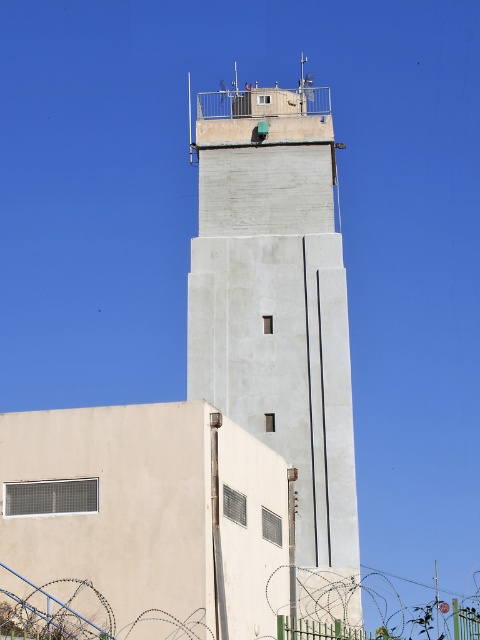
You are an engineer assessing the structural integrity of the scene. Given that the concrete tower at upper center and the green wire mesh fence at center are both subject to wind forces, which structure might experience greater lateral deflection due to its width? Please explain based on their widths.

The concrete tower at upper center has a larger width than the green wire mesh fence at center. Since wider structures generally have greater stiffness and resistance to lateral deflection, the green wire mesh fence at center would likely experience more deflection under wind forces compared to the concrete tower at upper center.

You are standing in a field and see the concrete tower at upper center and the green wire mesh fence at center. Which object is closer to you?

The concrete tower at upper center is closer to you because the green wire mesh fence at center is behind it.

You are a maintenance worker needing to reach the concrete tower at upper center to perform routine checks. You have a ladder that is 30 meters long. The green wire mesh fence at center is blocking your path. Can you safely use the ladder to reach the tower without crossing the fence?

The concrete tower at upper center and green wire mesh fence at center are 29.12 meters apart from each other. Since the ladder is 30 meters long, it is longer than the distance between them. Therefore, the ladder can be used to safely reach the tower without crossing the fence.